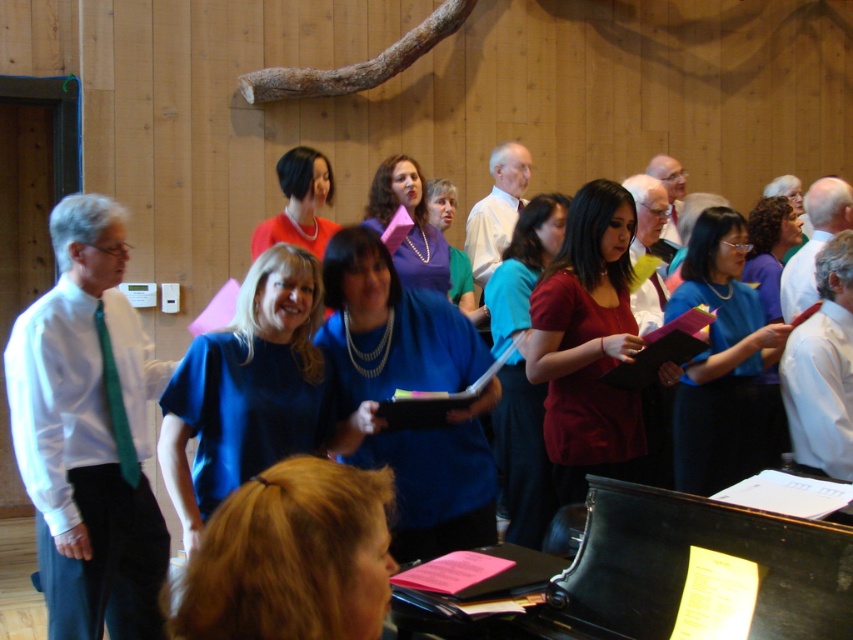
Who is shorter, matte red shirt at center or matte blue dress at center?

matte blue dress at center is shorter.

Does matte red shirt at center have a lesser height compared to matte blue dress at center?

In fact, matte red shirt at center may be taller than matte blue dress at center.

At what (x,y) coordinates should I click in order to perform the action: click on matte red shirt at center. Please return your answer as a coordinate pair (x, y). This screenshot has width=853, height=640. Looking at the image, I should click on (590, 349).

Between point (264, 486) and point (251, 435), which one is positioned in front?

Positioned in front is point (264, 486).

Is blonde hair at center wider than blue matte shirt at center?

Incorrect, blonde hair at center's width does not surpass blue matte shirt at center's.

I want to click on blonde hair at center, so click(291, 557).

Consider the image. Does matte red shirt at center have a greater height compared to blue fabric shirt at center?

No, matte red shirt at center is not taller than blue fabric shirt at center.

Measure the distance between matte red shirt at center and camera.

A distance of 8.81 feet exists between matte red shirt at center and camera.

I want to click on matte red shirt at center, so click(x=590, y=349).